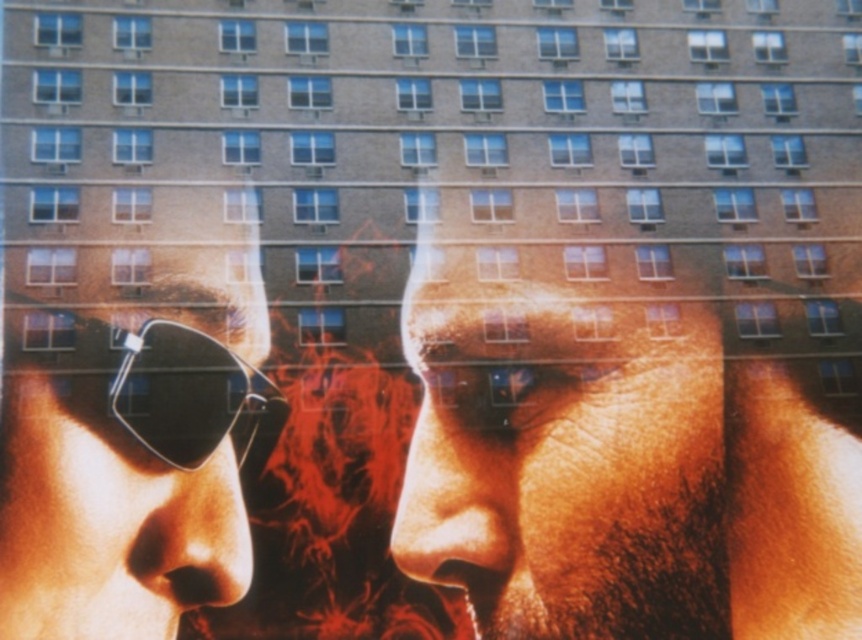
Which of these two, smooth skin face at center or black matte goggles at left, stands shorter?

black matte goggles at left

Describe the element at coordinates (563, 458) in the screenshot. I see `smooth skin face at center` at that location.

Find the location of a particular element. The width and height of the screenshot is (862, 640). smooth skin face at center is located at coordinates (563, 458).

This screenshot has height=640, width=862. What do you see at coordinates (107, 518) in the screenshot?
I see `matte black sunglasses at left` at bounding box center [107, 518].

Is point (216, 502) positioned behind point (91, 385)?

No.

Where is `matte black sunglasses at left`? This screenshot has height=640, width=862. matte black sunglasses at left is located at coordinates (107, 518).

Does smooth skin face at center have a smaller size compared to matte black sunglasses at left?

Incorrect, smooth skin face at center is not smaller in size than matte black sunglasses at left.

Is point (454, 509) positioned before point (242, 308)?

Yes, point (454, 509) is closer to viewer.

Where is `smooth skin face at center`? smooth skin face at center is located at coordinates (563, 458).